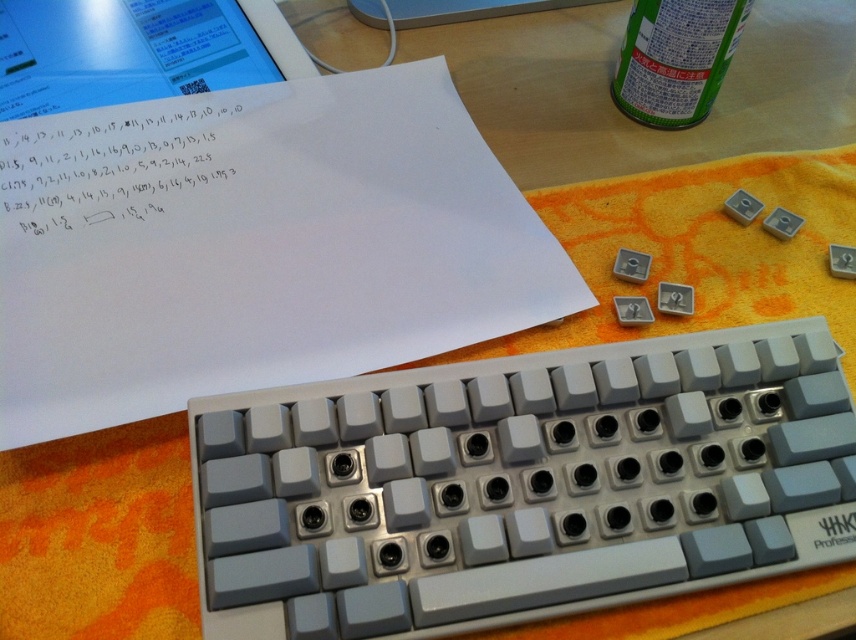
Can you confirm if white paper at upper left is positioned to the left of green matte can at upper right?

Correct, you'll find white paper at upper left to the left of green matte can at upper right.

Can you confirm if white paper at upper left is smaller than green matte can at upper right?

No, white paper at upper left is not smaller than green matte can at upper right.

Is point (437, 348) closer to camera compared to point (664, 72)?

That is True.

What are the coordinates of `white paper at upper left` in the screenshot? It's located at (254, 244).

Does white plastic keyboard at center have a smaller size compared to green matte can at upper right?

Actually, white plastic keyboard at center might be larger than green matte can at upper right.

Does white plastic keyboard at center have a greater height compared to green matte can at upper right?

Correct, white plastic keyboard at center is much taller as green matte can at upper right.

Does point (525, 612) lie in front of point (660, 106)?

Yes, point (525, 612) is in front of point (660, 106).

Identify the location of white plastic keyboard at center. The width and height of the screenshot is (856, 640). (522, 484).

Does white plastic keyboard at center have a lesser width compared to white paper at upper left?

Correct, white plastic keyboard at center's width is less than white paper at upper left's.

Who is more forward, (703, 332) or (120, 260)?

Positioned in front is point (703, 332).

Where is `white plastic keyboard at center`? This screenshot has width=856, height=640. white plastic keyboard at center is located at coordinates click(x=522, y=484).